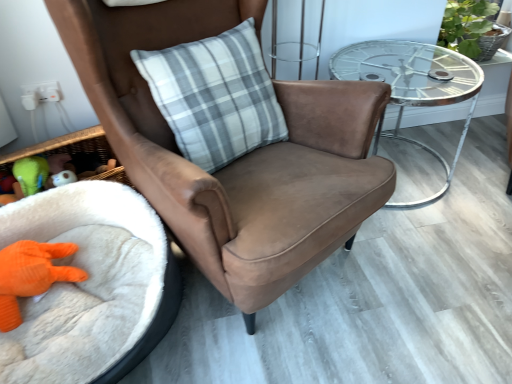
I want to click on green rubber duck at lower left, the 1th toy when ordered from top to bottom, so click(31, 174).

Which is in front, metallic glass table at right or green leafy plant at upper right?

metallic glass table at right is in front.

How much distance is there between metallic glass table at right and green leafy plant at upper right?

metallic glass table at right is 11.42 inches from green leafy plant at upper right.

Who is shorter, metallic glass table at right or green leafy plant at upper right?

Standing shorter between the two is green leafy plant at upper right.

Which of these two, metallic glass table at right or green leafy plant at upper right, is thinner?

green leafy plant at upper right is thinner.

Does white fluffy infant bed at lower left have a lesser height compared to suede brown armchair at center?

Yes.

From a real-world perspective, is white fluffy infant bed at lower left located higher than suede brown armchair at center?

No, from a real-world perspective, white fluffy infant bed at lower left is not over suede brown armchair at center

Considering the positions of objects white fluffy infant bed at lower left and suede brown armchair at center in the image provided, who is more to the right, white fluffy infant bed at lower left or suede brown armchair at center?

From the viewer's perspective, suede brown armchair at center appears more on the right side.

At what (x,y) coordinates should I click in order to perform the action: click on chair above the white fluffy infant bed at lower left (from the image's perspective). Please return your answer as a coordinate pair (x, y). The image size is (512, 384). Looking at the image, I should click on (239, 158).

Looking at this image, could suede brown armchair at center be considered to be inside metallic glass table at right?

No, suede brown armchair at center is not inside metallic glass table at right.

From the image's perspective, would you say metallic glass table at right is positioned over suede brown armchair at center?

Yes.

Is metallic glass table at right to the left or to the right of suede brown armchair at center in the image?

Clearly, metallic glass table at right is on the right of suede brown armchair at center in the image.

From a real-world perspective, is green rubber duck at lower left, the 1th toy when ordered from top to bottom, on suede brown armchair at center?

No.

Is point (19, 166) farther from camera compared to point (125, 163)?

Yes, it is behind point (125, 163).

Is green rubber duck at lower left, the 1th toy when ordered from top to bottom, outside of suede brown armchair at center?

green rubber duck at lower left, the 1th toy when ordered from top to bottom, lies outside suede brown armchair at center's area.

From the image's perspective, is green rubber duck at lower left, the 1th toy when ordered from top to bottom, located above gray plaid pillow at center?

Actually, green rubber duck at lower left, the 1th toy when ordered from top to bottom, appears below gray plaid pillow at center in the image.

Is the surface of green rubber duck at lower left, the 1th toy when ordered from top to bottom, in direct contact with gray plaid pillow at center?

No, green rubber duck at lower left, the 1th toy when ordered from top to bottom, is not next to gray plaid pillow at center.

Identify the location of pillow that appears above the green rubber duck at lower left, the 1th toy when ordered from top to bottom (from a real-world perspective). The height and width of the screenshot is (384, 512). (215, 96).

From a real-world perspective, between green rubber duck at lower left, placed as the second toy when sorted from bottom to top, and gray plaid pillow at center, who is vertically higher?

gray plaid pillow at center is physically above.

Between green rubber duck at lower left, placed as the second toy when sorted from bottom to top, and white fluffy infant bed at lower left, which one has smaller size?

With smaller size is green rubber duck at lower left, placed as the second toy when sorted from bottom to top.

Is green rubber duck at lower left, placed as the second toy when sorted from bottom to top, oriented away from white fluffy infant bed at lower left?

Yes, green rubber duck at lower left, placed as the second toy when sorted from bottom to top, is positioned with its back facing white fluffy infant bed at lower left.

Can you confirm if green rubber duck at lower left, the 1th toy when ordered from top to bottom, is wider than white fluffy infant bed at lower left?

No, green rubber duck at lower left, the 1th toy when ordered from top to bottom, is not wider than white fluffy infant bed at lower left.

Is green rubber duck at lower left, placed as the second toy when sorted from bottom to top, further to camera compared to white fluffy infant bed at lower left?

Yes, it is behind white fluffy infant bed at lower left.

Would you say gray plaid pillow at center is to the left or to the right of green leafy plant at upper right in the picture?

In the image, gray plaid pillow at center appears on the left side of green leafy plant at upper right.

Considering the relative sizes of gray plaid pillow at center and green leafy plant at upper right in the image provided, is gray plaid pillow at center shorter than green leafy plant at upper right?

In fact, gray plaid pillow at center may be taller than green leafy plant at upper right.

Can you confirm if gray plaid pillow at center is wider than green leafy plant at upper right?

In fact, gray plaid pillow at center might be narrower than green leafy plant at upper right.

Is gray plaid pillow at center not close to green leafy plant at upper right?

gray plaid pillow at center is positioned a significant distance from green leafy plant at upper right.

What are the coordinates of `plant located behind the metallic glass table at right` in the screenshot? It's located at (466, 25).

You are a GUI agent. You are given a task and a screenshot of the screen. Output one action in this format:
    pyautogui.click(x=<x>, y=<y>)
    Task: Click on the chair that appears in front of the white fluffy infant bed at lower left
    The width and height of the screenshot is (512, 384).
    Given the screenshot: What is the action you would take?
    [x=239, y=158]

Based on their spatial positions, is orange knitted toy at lower left, the 2th toy positioned from the top, or suede brown armchair at center further from green leafy plant at upper right?

orange knitted toy at lower left, the 2th toy positioned from the top, is further to green leafy plant at upper right.

Looking at the image, which one is located further to green leafy plant at upper right, metallic glass table at right or green rubber duck at lower left, placed as the second toy when sorted from bottom to top?

green rubber duck at lower left, placed as the second toy when sorted from bottom to top, is further to green leafy plant at upper right.

Based on their spatial positions, is white fluffy infant bed at lower left or gray plaid pillow at center closer to green rubber duck at lower left, the 1th toy when ordered from top to bottom?

white fluffy infant bed at lower left.

Based on their spatial positions, is green rubber duck at lower left, the 1th toy when ordered from top to bottom, or white fluffy infant bed at lower left further from metallic glass table at right?

green rubber duck at lower left, the 1th toy when ordered from top to bottom, lies further to metallic glass table at right than the other object.

Considering their positions, is gray plaid pillow at center positioned further to green rubber duck at lower left, placed as the second toy when sorted from bottom to top, than suede brown armchair at center?

suede brown armchair at center is positioned further to the anchor green rubber duck at lower left, placed as the second toy when sorted from bottom to top.

When comparing their distances from green leafy plant at upper right, does orange knitted toy at lower left, the first toy in the bottom-to-top sequence, or green rubber duck at lower left, the 1th toy when ordered from top to bottom, seem further?

orange knitted toy at lower left, the first toy in the bottom-to-top sequence, is further to green leafy plant at upper right.

Estimate the real-world distances between objects in this image. Which object is further from green rubber duck at lower left, the 1th toy when ordered from top to bottom, orange knitted toy at lower left, the 2th toy positioned from the top, or metallic glass table at right?

metallic glass table at right.

Based on their spatial positions, is green leafy plant at upper right or orange knitted toy at lower left, the first toy in the bottom-to-top sequence, closer to white fluffy infant bed at lower left?

Based on the image, orange knitted toy at lower left, the first toy in the bottom-to-top sequence, appears to be nearer to white fluffy infant bed at lower left.

Where is `table located between orange knitted toy at lower left, the 2th toy positioned from the top, and green leafy plant at upper right in the left-right direction`? table located between orange knitted toy at lower left, the 2th toy positioned from the top, and green leafy plant at upper right in the left-right direction is located at coordinates (413, 84).

This screenshot has width=512, height=384. Find the location of `pillow between orange knitted toy at lower left, the 2th toy positioned from the top, and green leafy plant at upper right`. pillow between orange knitted toy at lower left, the 2th toy positioned from the top, and green leafy plant at upper right is located at coordinates (215, 96).

Image resolution: width=512 pixels, height=384 pixels. In order to click on toy located between green rubber duck at lower left, placed as the second toy when sorted from bottom to top, and metallic glass table at right in the left-right direction in this screenshot , I will do `click(31, 275)`.

In order to click on infant bed between green rubber duck at lower left, placed as the second toy when sorted from bottom to top, and metallic glass table at right, in the horizontal direction in this screenshot , I will do `click(91, 285)`.